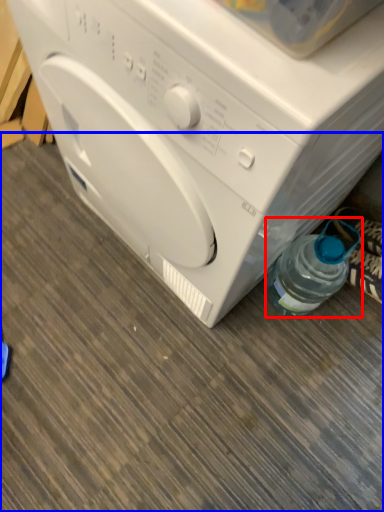
Question: Among these objects, which one is farthest to the camera, bottle (highlighted by a red box) or surface (highlighted by a blue box)?

Choices:
 (A) bottle
 (B) surface

Answer: (A)